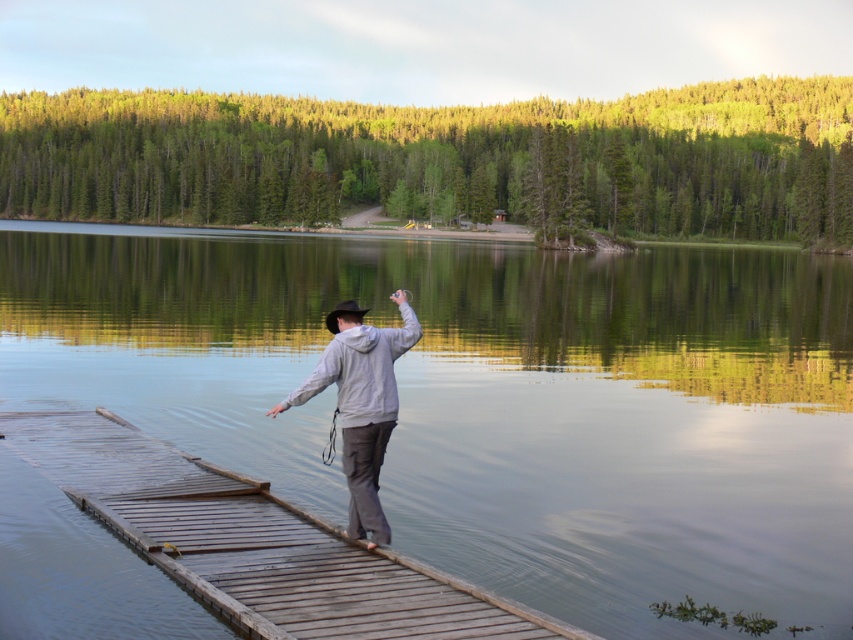
Question: Is smooth water at dock center to the right of gray matte hoodie at center from the viewer's perspective?

Choices:
 (A) no
 (B) yes

Answer: (B)

Question: Is smooth water at dock center bigger than gray matte hoodie at center?

Choices:
 (A) no
 (B) yes

Answer: (B)

Question: Which object is farther from the camera taking this photo?

Choices:
 (A) smooth water at dock center
 (B) wooden dock at center

Answer: (A)

Question: Can you confirm if wooden dock at center is bigger than gray matte hoodie at center?

Choices:
 (A) no
 (B) yes

Answer: (B)

Question: Among these objects, which one is nearest to the camera?

Choices:
 (A) smooth water at dock center
 (B) gray matte hoodie at center
 (C) wooden dock at center

Answer: (C)

Question: Among these objects, which one is nearest to the camera?

Choices:
 (A) wooden dock at center
 (B) smooth water at dock center

Answer: (A)